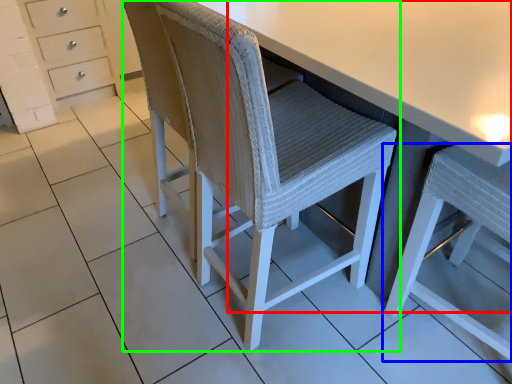
Question: Based on their relative distances, which object is nearer to table (highlighted by a red box)? Choose from chair (highlighted by a blue box) and chair (highlighted by a green box).

Choices:
 (A) chair
 (B) chair

Answer: (B)